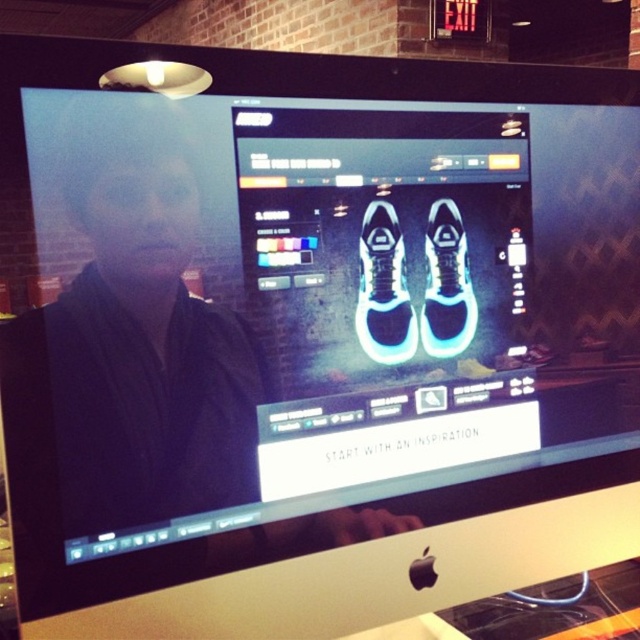
Does white matte sneakers at center come behind white matte sneaker at center?

No, it is in front of white matte sneaker at center.

Is point (376, 202) closer to viewer compared to point (449, 317)?

Yes, point (376, 202) is in front of point (449, 317).

Is point (385, 296) in front of point (464, 260)?

Yes.

Locate an element on the screen. This screenshot has width=640, height=640. white matte sneakers at center is located at coordinates (384, 289).